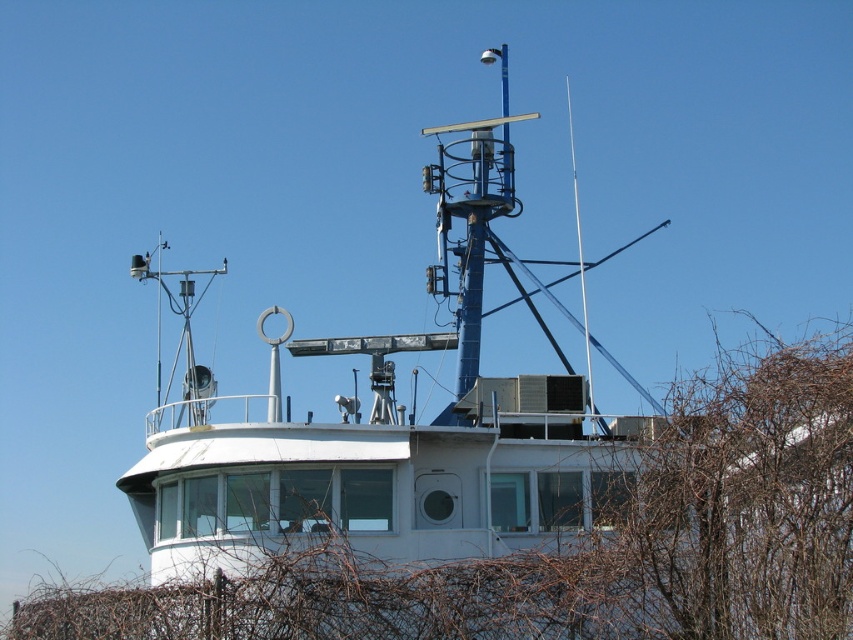
Question: Which point is closer to the camera taking this photo?

Choices:
 (A) (488, 192)
 (B) (254, 604)

Answer: (B)

Question: Which object is closer to the camera taking this photo?

Choices:
 (A) white matte boat at center
 (B) brown leafless branches at lower right

Answer: (B)

Question: Observing the image, what is the correct spatial positioning of brown leafless branches at lower right in reference to white matte boat at center?

Choices:
 (A) above
 (B) below

Answer: (B)

Question: Does brown leafless branches at lower right have a lesser width compared to white matte boat at center?

Choices:
 (A) no
 (B) yes

Answer: (A)

Question: Is brown leafless branches at lower right smaller than white matte boat at center?

Choices:
 (A) yes
 (B) no

Answer: (A)